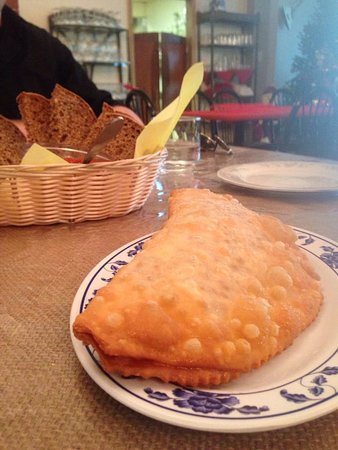
Find the location of `door`. door is located at coordinates (144, 62), (166, 74).